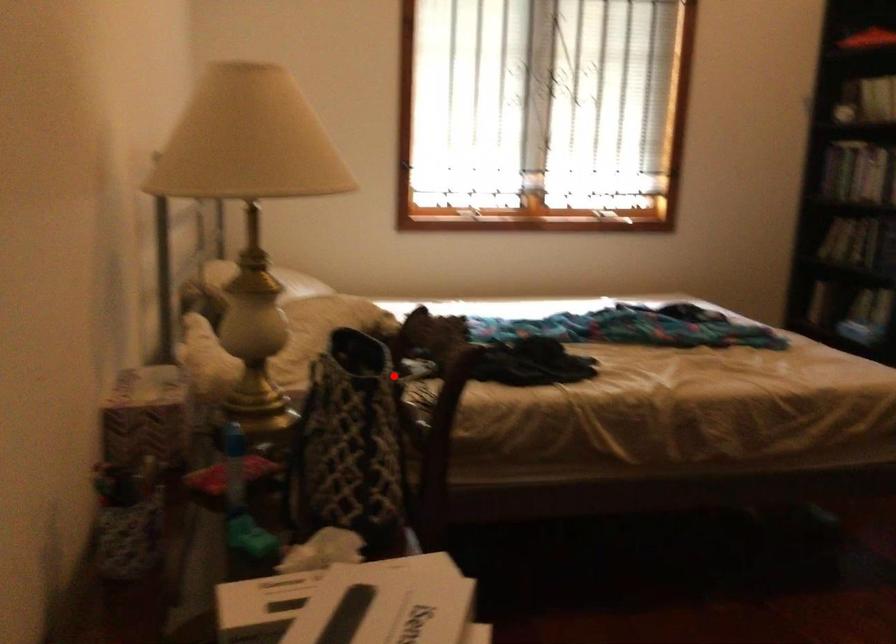
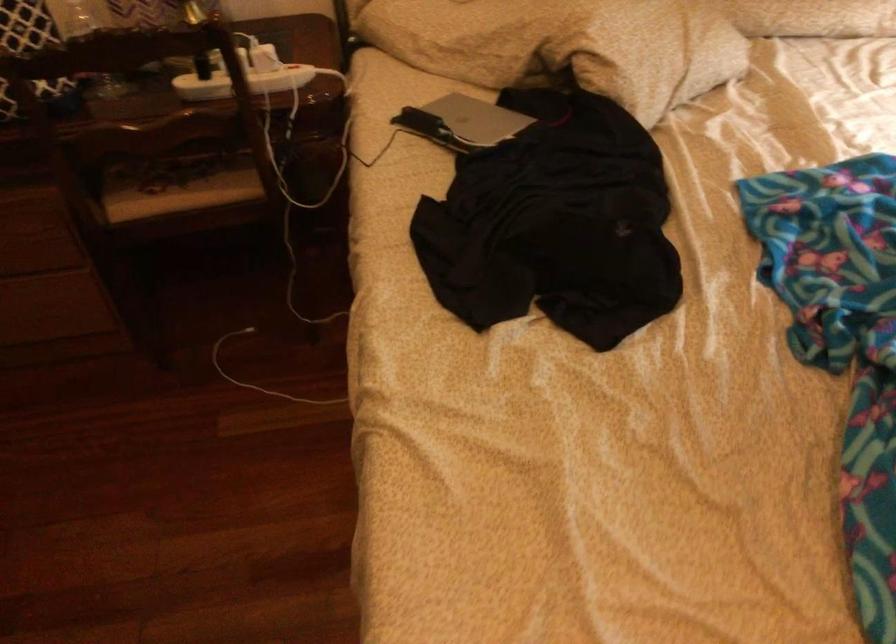
Where in the second image is the point corresponding to the highlighted location from the first image?

(243, 82)